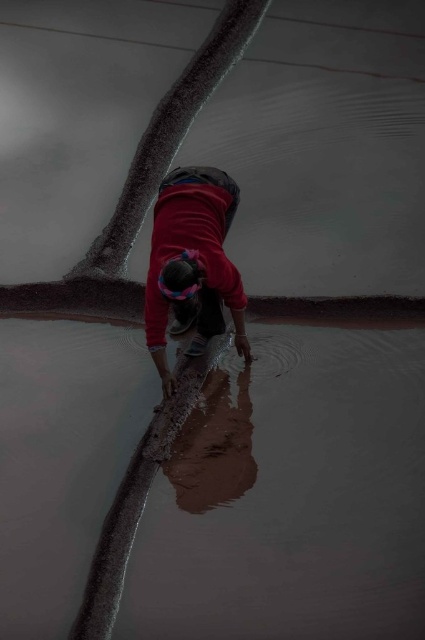
Question: Can you confirm if brown clay flood at lower center is wider than red fabric person at center?

Choices:
 (A) yes
 (B) no

Answer: (A)

Question: Is brown clay flood at lower center thinner than red fabric person at center?

Choices:
 (A) yes
 (B) no

Answer: (B)

Question: Which object appears closest to the camera in this image?

Choices:
 (A) brown clay flood at lower center
 (B) red fabric person at center

Answer: (A)

Question: Which object is farther from the camera taking this photo?

Choices:
 (A) brown clay flood at lower center
 (B) red fabric person at center

Answer: (B)

Question: Does brown clay flood at lower center have a smaller size compared to red fabric person at center?

Choices:
 (A) no
 (B) yes

Answer: (A)